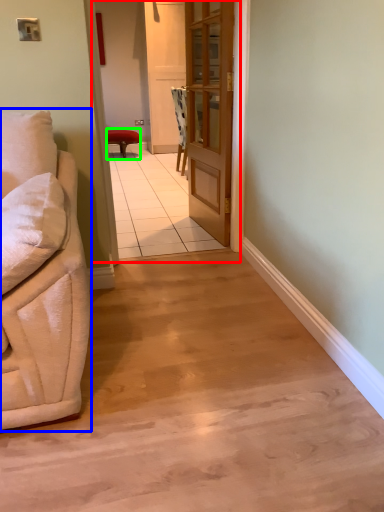
Question: Based on their relative distances, which object is nearer to corridor (highlighted by a red box)? Choose from studio couch (highlighted by a blue box) and stool (highlighted by a green box).

Choices:
 (A) studio couch
 (B) stool

Answer: (B)